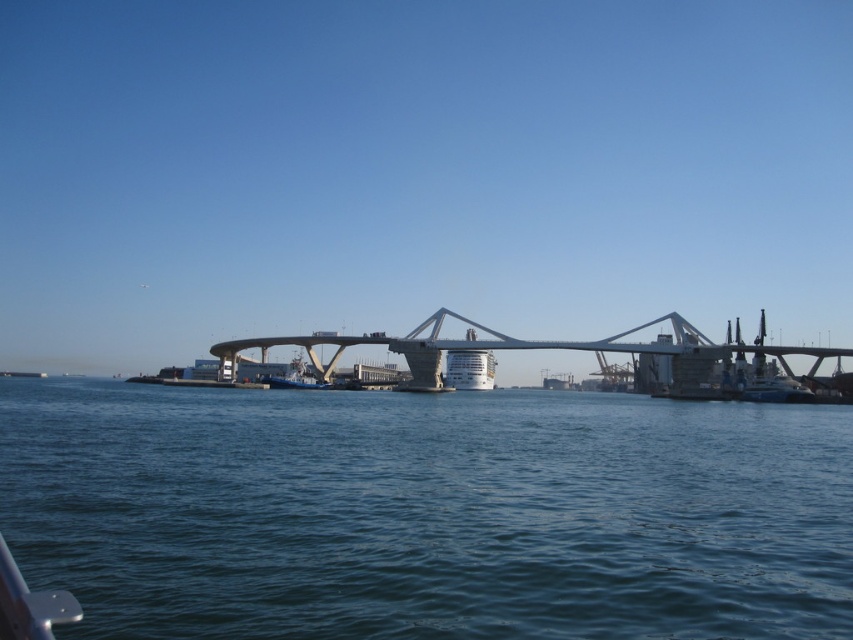
You are standing at the point marked as point (426, 513) in the image. What is the immediate surface you are standing on?

The point (426, 513) is on blue water at center, so the immediate surface you are standing on is blue water at center.

You are standing on the left side of the bridge and want to see the blue water at center. Which direction should you look relative to the white concrete bridge at center?

You should look to the left of the white concrete bridge at center to see the blue water at center, as the blue water at center is located to the left of the white concrete bridge at center.